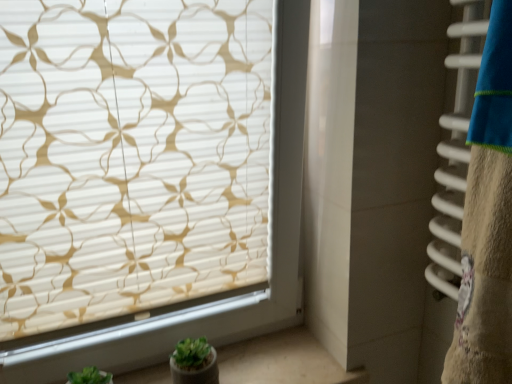
Find the location of a particular element. This screenshot has width=512, height=384. blank space situated above white smooth window sill at lower left (from a real-world perspective) is located at coordinates (268, 359).